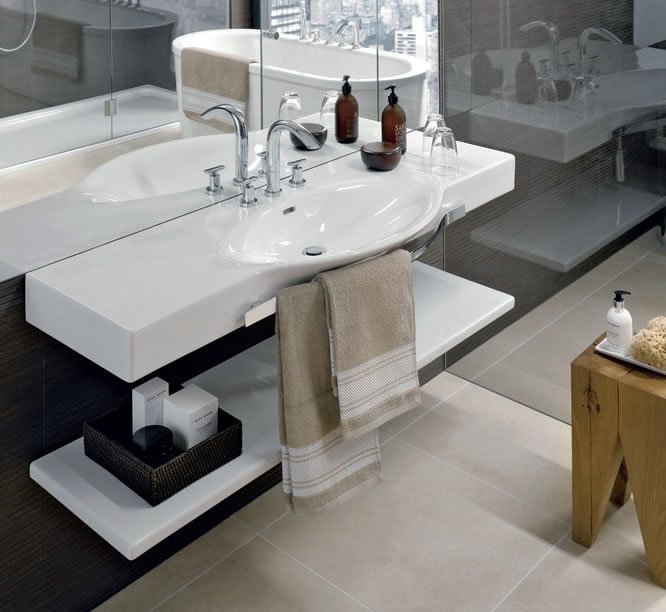
The width and height of the screenshot is (666, 612). Identify the location of cabinet handle. (272, 34).